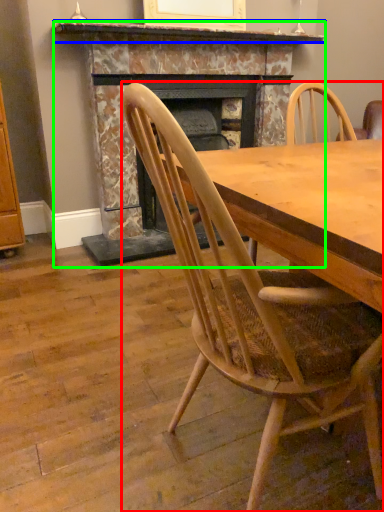
Question: Based on their relative distances, which object is nearer to chair (highlighted by a red box)? Choose from mantle (highlighted by a blue box) and fireplace (highlighted by a green box).

Choices:
 (A) mantle
 (B) fireplace

Answer: (B)